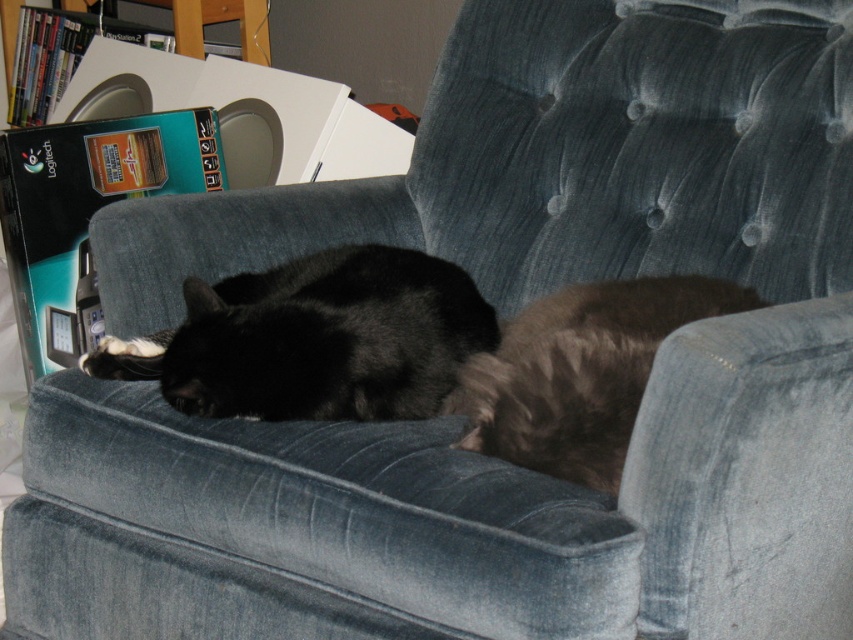
Question: Which point appears closest to the camera in this image?

Choices:
 (A) (421, 310)
 (B) (589, 310)

Answer: (B)

Question: Is black fur cat at center below brown fuzzy cat at lower right?

Choices:
 (A) no
 (B) yes

Answer: (A)

Question: Does black fur cat at center appear under brown fuzzy cat at lower right?

Choices:
 (A) yes
 (B) no

Answer: (B)

Question: Where is black fur cat at center located in relation to brown fuzzy cat at lower right in the image?

Choices:
 (A) above
 (B) below

Answer: (A)

Question: Which of the following is the closest to the observer?

Choices:
 (A) (154, 376)
 (B) (482, 412)

Answer: (B)